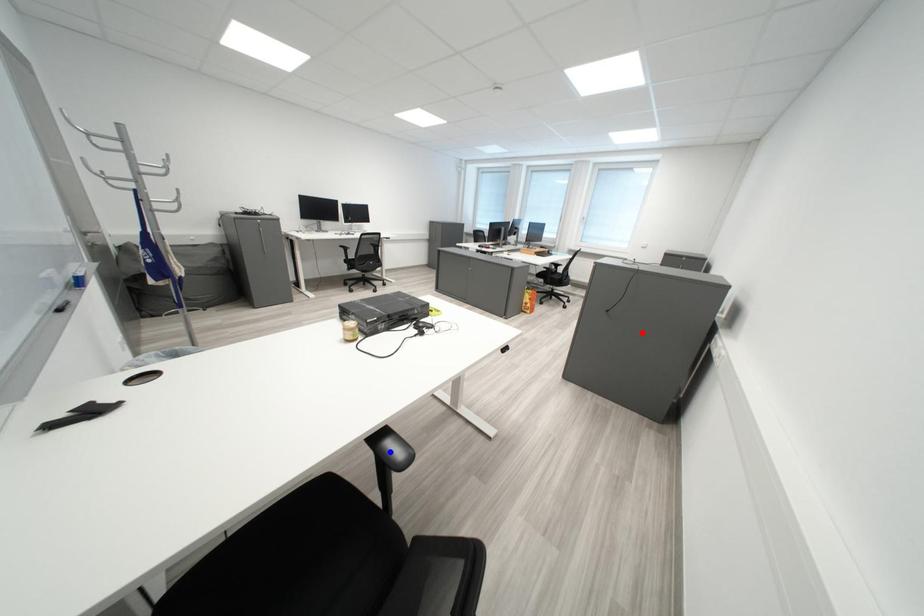
Question: Two points are marked on the image. Which point is closer to the camera?

Choices:
 (A) Blue point is closer.
 (B) Red point is closer.

Answer: (A)